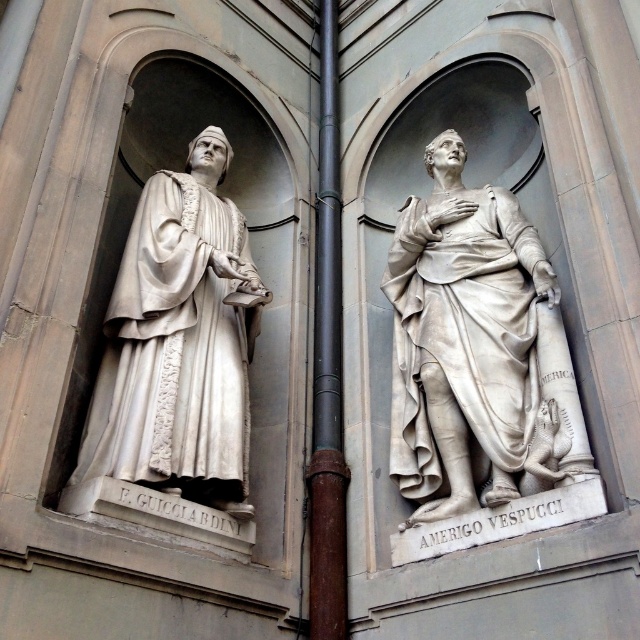
Does white marble statue at left have a greater width compared to brown metal pipe at center?

Yes.

Based on the photo, does white marble statue at left appear on the right side of brown metal pipe at center?

Incorrect, white marble statue at left is not on the right side of brown metal pipe at center.

Does point (204, 458) come closer to viewer compared to point (330, 236)?

Yes, it is.

This screenshot has height=640, width=640. Find the location of `white marble statue at left`. white marble statue at left is located at coordinates (179, 342).

Does white marble statue at center appear over white marble statue at left?

Actually, white marble statue at center is below white marble statue at left.

I want to click on white marble statue at center, so click(464, 340).

Find the location of a particular element. white marble statue at center is located at coordinates (464, 340).

Which of these two, white marble statue at center or brown metal pipe at center, stands taller?

With more height is brown metal pipe at center.

Who is more forward, (538,403) or (332,355)?

Positioned in front is point (538,403).

Who is more forward, (458, 278) or (316, 550)?

Point (316, 550) is more forward.

Find the location of a particular element. The height and width of the screenshot is (640, 640). white marble statue at center is located at coordinates (464, 340).